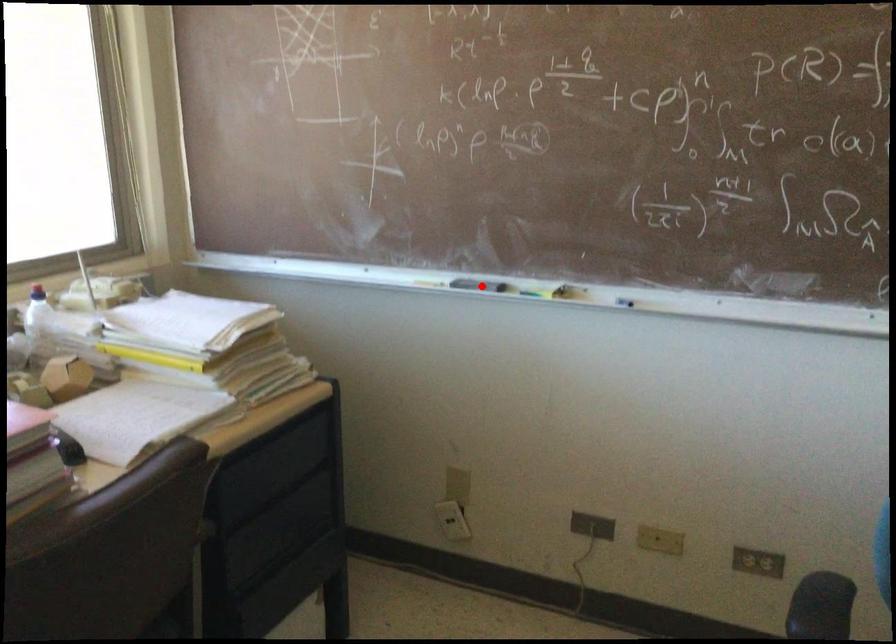
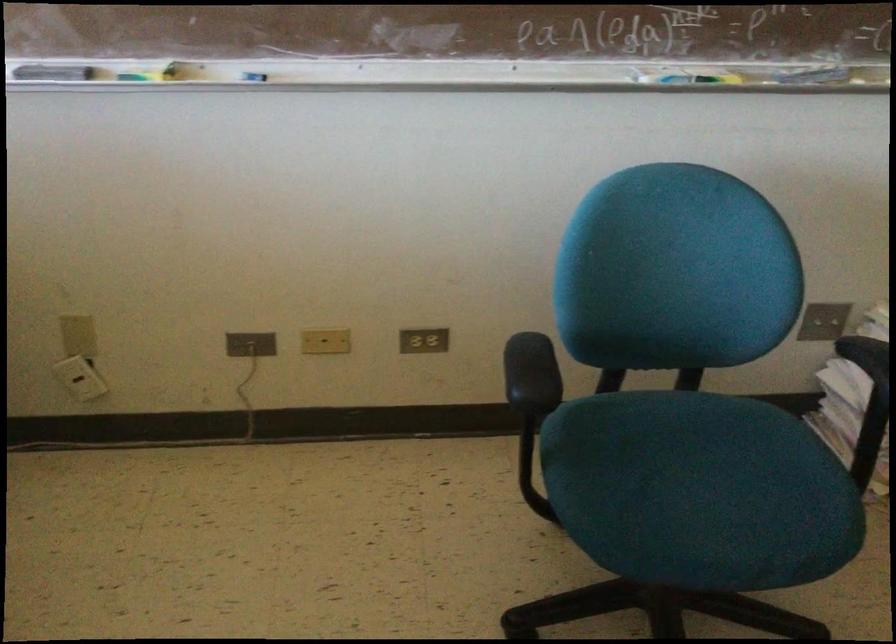
Question: I am providing you with two images of the same scene from different viewpoints. A red point is marked on the first image. At the location where the point appears in image 1, is it still visible in image 2?

Choices:
 (A) Yes
 (B) No

Answer: (A)